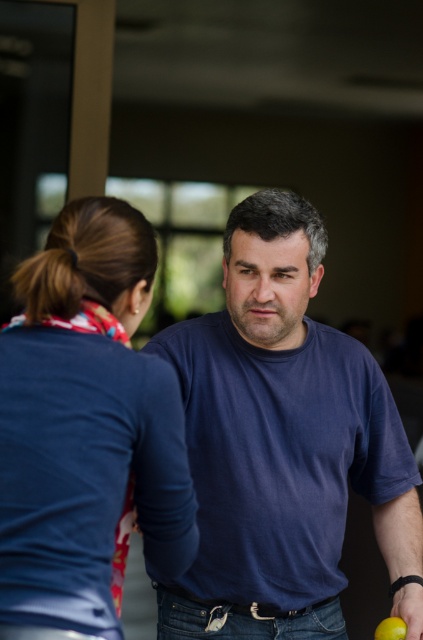
Based on the photo, you are a photographer standing 1.5 meters away from the camera position. You want to take a photo of the blue fabric shirt at upper left. Can you reach it with your hand to adjust it before taking the shot?

The blue fabric shirt at upper left is 1.34 meters from camera. Since you are standing 1.5 meters away from the camera position, you are 0.16 meters farther than the shirt. Therefore, you can reach it with your hand to adjust it before taking the shot.

From the picture: You are organizing a clothing and fruit display in a store. You have a blue fabric shirt at upper left and a green matte lime at lower right. If you want to arrange them side by side on a shelf, which item should you place first to ensure they both fit?

The blue fabric shirt at upper left is wider than the green matte lime at lower right. Since the shirt is wider, you should place the blue fabric shirt at upper left first to accommodate its larger size, then position the green matte lime at lower right next.